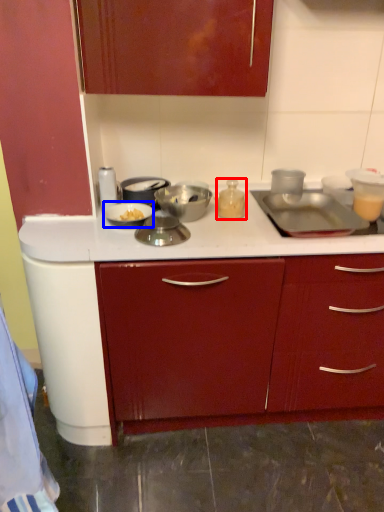
Question: Which point is closer to the camera, kitchen appliance (highlighted by a red box) or kitchen appliance (highlighted by a blue box)?

Choices:
 (A) kitchen appliance
 (B) kitchen appliance

Answer: (B)